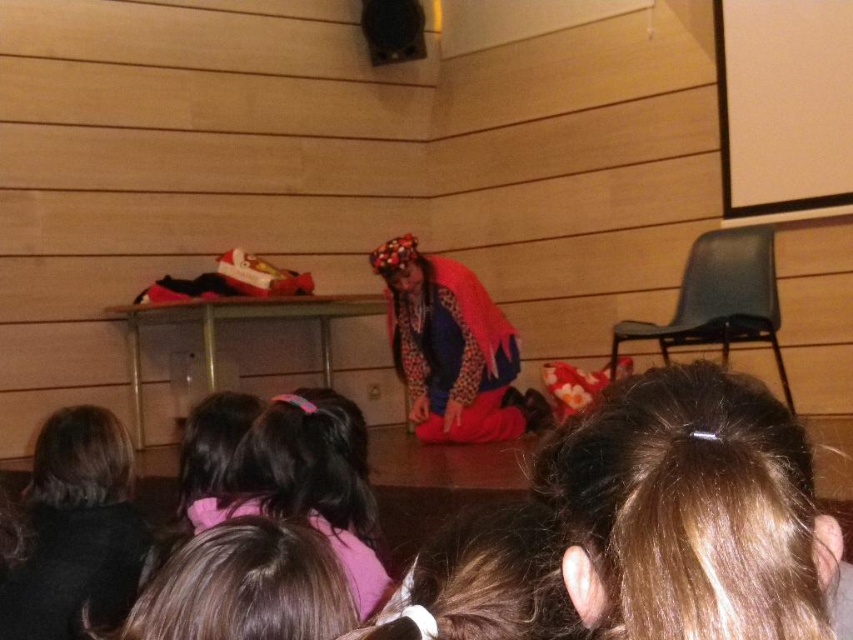
Question: Which point is farther to the camera?

Choices:
 (A) (132, 568)
 (B) (653, 374)

Answer: (A)

Question: Which object is positioned closest to the pink fabric hairband at center?

Choices:
 (A) dark brown hair at lower left
 (B) velvet red cape at center

Answer: (A)

Question: Estimate the real-world distances between objects in this image. Which object is farther from the dark brown hair at lower left?

Choices:
 (A) pink fabric hairband at center
 (B) velvet red cape at center
 (C) brown hair at upper center

Answer: (B)

Question: Does velvet red cape at center have a larger size compared to pink fabric hairband at center?

Choices:
 (A) yes
 (B) no

Answer: (A)

Question: Is dark brown hair at lower left above velvet red cape at center?

Choices:
 (A) no
 (B) yes

Answer: (A)

Question: Is dark brown hair at lower left positioned at the back of pink fabric hairband at center?

Choices:
 (A) yes
 (B) no

Answer: (A)